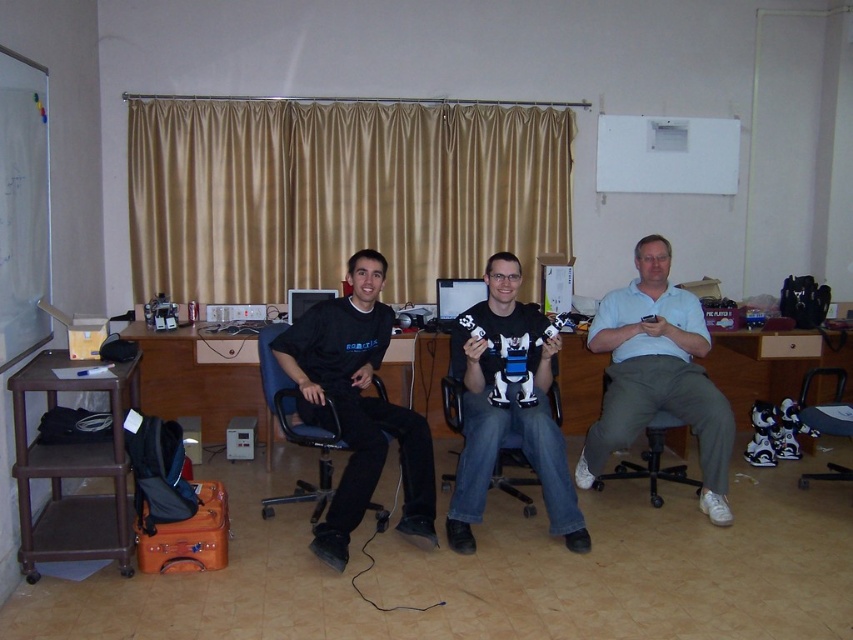
You are trying to place a laptop on the brown wood computer desk at center. Considering the height of the blue plastic chair at left, will your arms be comfortable while typing?

The brown wood computer desk at center has a lesser height compared to blue plastic chair at left, so the desk is lower than the chair. This may result in your arms being at an uncomfortable angle while typing since the desk is lower than the chair.

You are standing in the room and want to move from the point at coordinates point (265, 436) to the point at coordinates point (276, 408). Which direction should you move to reach your destination?

You should move forward because point (265, 436) is behind point (276, 408), so moving forward from point (265, 436) will take you toward point (276, 408).

You are sitting in the blue plastic chair at left and want to reach the brown wood computer desk at center. Which direction should you move to get there?

You should move to your right to reach the brown wood computer desk at center because it is located to the left of the blue plastic chair at left, meaning the desk is on the right side from the chair.